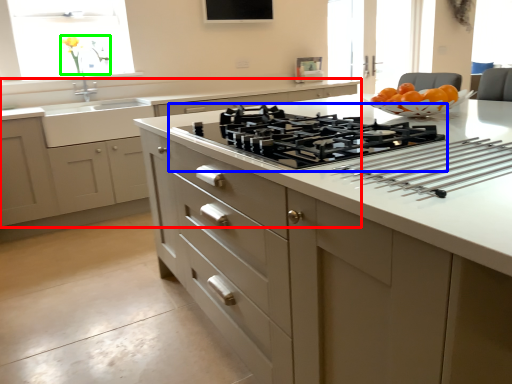
Question: Which object is the farthest from cabinetry (highlighted by a red box)? Choose among these: gas stove (highlighted by a blue box) or flower (highlighted by a green box).

Choices:
 (A) gas stove
 (B) flower

Answer: (A)